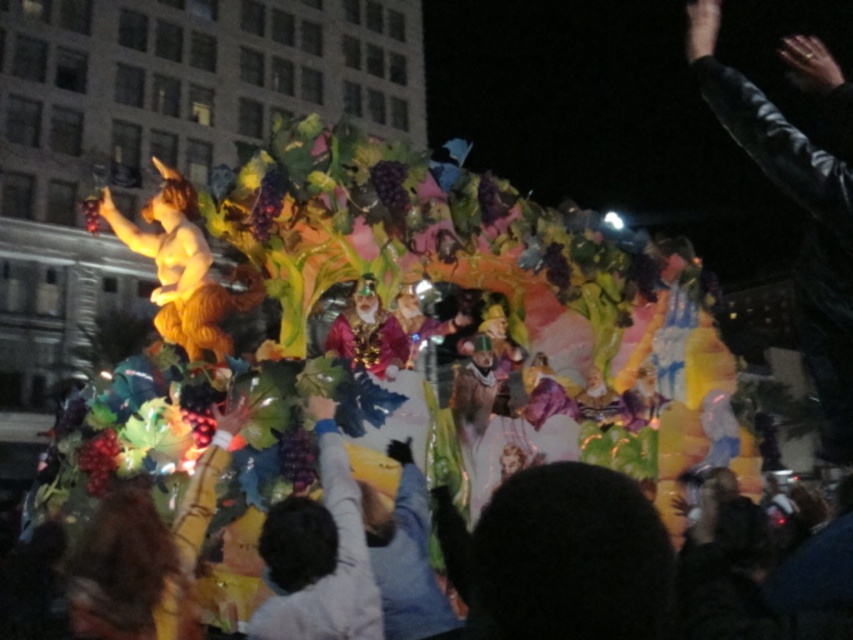
Consider the image. Which is above, black leather jacket at upper right or smooth purple grapes at center?

black leather jacket at upper right

Consider the image. Between black leather jacket at upper right and smooth purple grapes at center, which one has less height?

With less height is smooth purple grapes at center.

What do you see at coordinates (798, 196) in the screenshot? I see `black leather jacket at upper right` at bounding box center [798, 196].

What are the coordinates of `black leather jacket at upper right` in the screenshot? It's located at [798, 196].